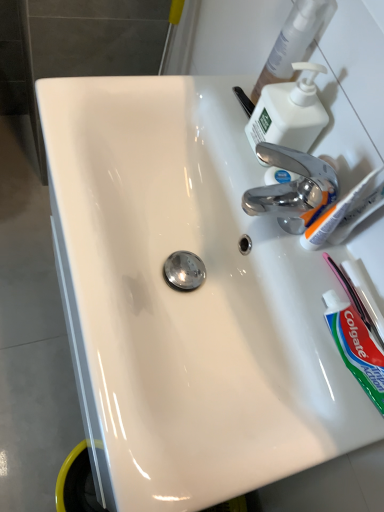
The image size is (384, 512). I want to click on vacant space situated on the left part of green matte toothpaste at lower right, so click(x=288, y=287).